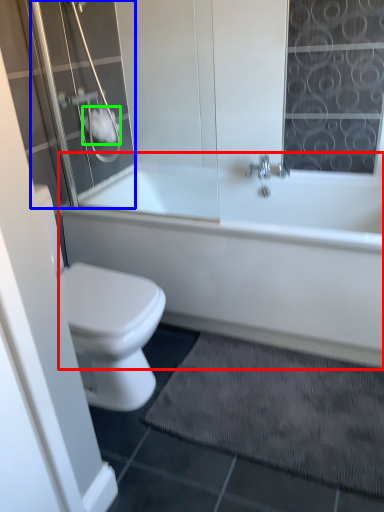
Question: Which object is the farthest from bathtub (highlighted by a red box)? Choose among these: shower door (highlighted by a blue box) or toilet paper (highlighted by a green box).

Choices:
 (A) shower door
 (B) toilet paper

Answer: (B)